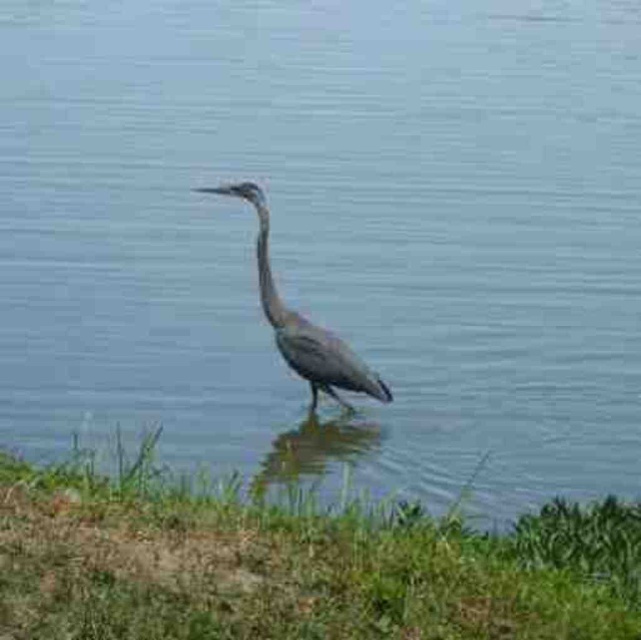
From the picture: Can you confirm if green grass at lower left is shorter than gray matte bird at center?

Correct, green grass at lower left is not as tall as gray matte bird at center.

Who is positioned more to the left, green grass at lower left or gray matte bird at center?

gray matte bird at center is more to the left.

Which is behind, point (442, 604) or point (279, 326)?

Point (279, 326)

Locate an element on the screen. The height and width of the screenshot is (640, 641). green grass at lower left is located at coordinates (287, 566).